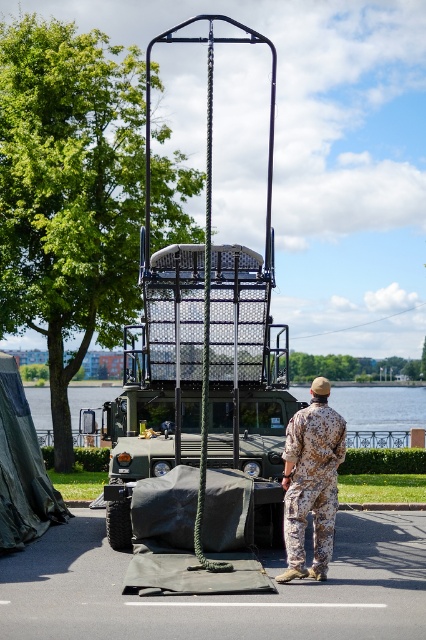
Does camouflage fabric uniform at center have a smaller size compared to green water at center?

Correct, camouflage fabric uniform at center occupies less space than green water at center.

Between camouflage fabric uniform at center and green water at center, which one has less height?

green water at center

Where is `camouflage fabric uniform at center`? The width and height of the screenshot is (426, 640). camouflage fabric uniform at center is located at coordinates click(x=311, y=481).